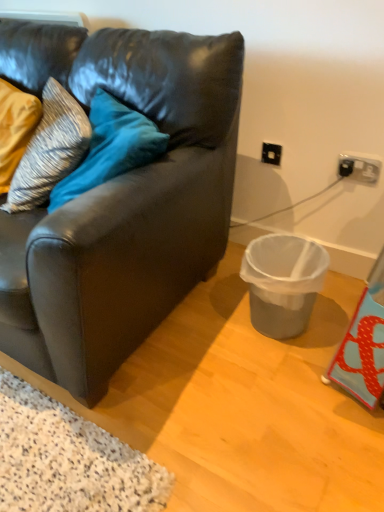
Question: From a real-world perspective, is gray plastic trash can at lower right positioned over matte black couch at center based on gravity?

Choices:
 (A) yes
 (B) no

Answer: (B)

Question: Considering the relative sizes of gray plastic trash can at lower right and matte black couch at center in the image provided, is gray plastic trash can at lower right thinner than matte black couch at center?

Choices:
 (A) yes
 (B) no

Answer: (A)

Question: From a real-world perspective, is gray plastic trash can at lower right below matte black couch at center?

Choices:
 (A) yes
 (B) no

Answer: (A)

Question: Is gray plastic trash can at lower right facing towards matte black couch at center?

Choices:
 (A) yes
 (B) no

Answer: (B)

Question: Can you confirm if gray plastic trash can at lower right is wider than matte black couch at center?

Choices:
 (A) no
 (B) yes

Answer: (A)

Question: From a real-world perspective, is matte black couch at center positioned above or below gray plastic trash can at lower right?

Choices:
 (A) below
 (B) above

Answer: (B)

Question: Choose the correct answer: Is matte black couch at center inside gray plastic trash can at lower right or outside it?

Choices:
 (A) outside
 (B) inside

Answer: (A)

Question: Looking at the image, does matte black couch at center seem bigger or smaller compared to gray plastic trash can at lower right?

Choices:
 (A) small
 (B) big

Answer: (B)

Question: Is matte black couch at center to the left or to the right of gray plastic trash can at lower right in the image?

Choices:
 (A) right
 (B) left

Answer: (B)

Question: Choose the correct answer: Is gray plastic trash can at lower right inside black plastic electric outlet at upper right or outside it?

Choices:
 (A) outside
 (B) inside

Answer: (A)

Question: From the image's perspective, is gray plastic trash can at lower right positioned above or below black plastic electric outlet at upper right?

Choices:
 (A) above
 (B) below

Answer: (B)

Question: Visually, is gray plastic trash can at lower right positioned to the left or to the right of black plastic electric outlet at upper right?

Choices:
 (A) left
 (B) right

Answer: (A)

Question: From a real-world perspective, is gray plastic trash can at lower right physically located above or below black plastic electric outlet at upper right?

Choices:
 (A) above
 (B) below

Answer: (B)

Question: Is matte black couch at center spatially inside black plastic power outlet at upper right, or outside of it?

Choices:
 (A) inside
 (B) outside

Answer: (B)

Question: From the image's perspective, is matte black couch at center above or below black plastic power outlet at upper right?

Choices:
 (A) above
 (B) below

Answer: (A)